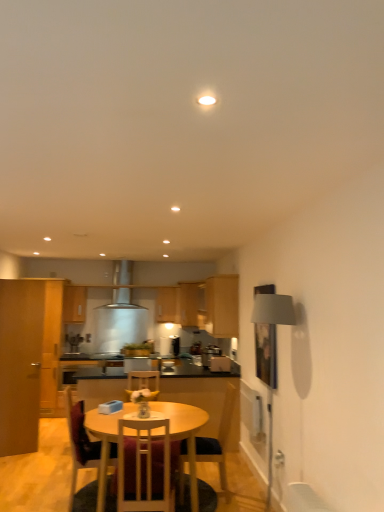
Question: Is satin black toaster at center, placed as the 1th appliance when sorted from left to right, inside the boundaries of wooden chair at center, which is the 4th chair in front-to-back order, or outside?

Choices:
 (A) outside
 (B) inside

Answer: (A)

Question: Visually, is satin black toaster at center, arranged as the 3th appliance when viewed from the front, positioned to the left or to the right of wooden chair at center, which is the 4th chair in front-to-back order?

Choices:
 (A) left
 (B) right

Answer: (B)

Question: Which is farther from the matte wood cabinet at upper center, which is the 3th cabinetry in back-to-front order?

Choices:
 (A) wooden chair at lower center, marked as the 2th chair in a front-to-back arrangement
 (B) matte wood cabinet at left, which appears as the fifth cabinetry when viewed from the back
 (C) wooden cabinet at center, the 4th cabinetry positioned from the back
 (D) satin silver toaster at center, arranged as the 2th appliance when viewed from the right
 (E) matte wood cabinet at center, the first cabinetry from the back

Answer: (A)

Question: Based on their relative distances, which object is farther from the satin silver coffee machine at center?

Choices:
 (A) matte wood cabinet at upper center, which ranks as the 3th cabinetry in front-to-back order
 (B) satin silver toaster at center, placed as the second appliance when sorted from front to back
 (C) matte wood cabinet at left, arranged as the first cabinetry when viewed from the left
 (D) wooden cabinet at center, the 2th cabinetry when ordered from front to back
 (E) satin black toaster at center, placed as the 3th appliance when sorted from right to left

Answer: (D)